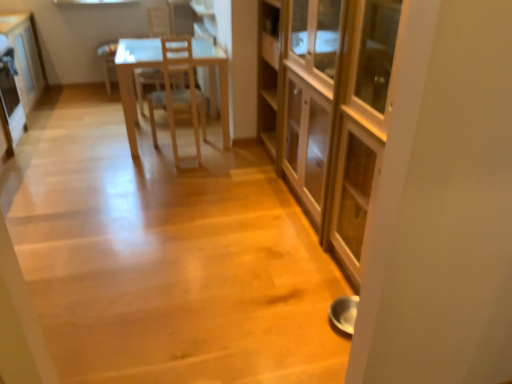
This screenshot has height=384, width=512. What do you see at coordinates (178, 94) in the screenshot?
I see `wooden chair at center` at bounding box center [178, 94].

The width and height of the screenshot is (512, 384). What do you see at coordinates (10, 98) in the screenshot?
I see `metallic refrigerator at left` at bounding box center [10, 98].

In order to click on metallic refrigerator at left in this screenshot , I will do `click(10, 98)`.

Measure the distance between white glossy cabinet at upper left, the 2th cabinetry from the front, and camera.

A distance of 3.25 meters exists between white glossy cabinet at upper left, the 2th cabinetry from the front, and camera.

Identify the location of matte wooden cabinet at center, which appears as the second cabinetry when viewed from the back. (328, 109).

Locate an element on the screen. This screenshot has height=384, width=512. appliance above the matte wooden cabinet at center, which is the first cabinetry from right to left (from the image's perspective) is located at coordinates (10, 98).

Considering the relative positions of metallic refrigerator at left and matte wooden cabinet at center, which is the first cabinetry from right to left, in the image provided, is metallic refrigerator at left to the right of matte wooden cabinet at center, which is the first cabinetry from right to left, from the viewer's perspective?

Incorrect, metallic refrigerator at left is not on the right side of matte wooden cabinet at center, which is the first cabinetry from right to left.

How many degrees apart are the facing directions of metallic refrigerator at left and matte wooden cabinet at center, which appears as the second cabinetry when viewed from the back?

There is a 179-degree angle between the facing directions of metallic refrigerator at left and matte wooden cabinet at center, which appears as the second cabinetry when viewed from the back.

Measure the distance between metallic refrigerator at left and matte wooden cabinet at center, the second cabinetry positioned from the left.

metallic refrigerator at left is 2.33 meters away from matte wooden cabinet at center, the second cabinetry positioned from the left.

From their relative heights in the image, would you say matte wooden cabinet at center, marked as the 1th cabinetry in a front-to-back arrangement, is taller or shorter than metallic refrigerator at left?

In the image, matte wooden cabinet at center, marked as the 1th cabinetry in a front-to-back arrangement, appears to be taller than metallic refrigerator at left.

Between matte wooden cabinet at center, the second cabinetry positioned from the left, and metallic refrigerator at left, which one has smaller size?

metallic refrigerator at left is smaller.

Is matte wooden cabinet at center, marked as the 1th cabinetry in a front-to-back arrangement, positioned in front of metallic refrigerator at left?

Yes, matte wooden cabinet at center, marked as the 1th cabinetry in a front-to-back arrangement, is in front of metallic refrigerator at left.

Would you consider matte wooden cabinet at center, marked as the 1th cabinetry in a front-to-back arrangement, to be distant from metallic refrigerator at left?

That's right, there is a large distance between matte wooden cabinet at center, marked as the 1th cabinetry in a front-to-back arrangement, and metallic refrigerator at left.

From the image's perspective, which object appears higher, light brown wooden chair at center or wooden chair at center?

light brown wooden chair at center.

From a real-world perspective, which is physically below, light brown wooden chair at center or wooden chair at center?

light brown wooden chair at center, from a real-world perspective.

Is light brown wooden chair at center located outside wooden chair at center?

Yes.

Would you consider wooden chair at center to be distant from matte wooden cabinet at center, marked as the 1th cabinetry in a front-to-back arrangement?

No, wooden chair at center is not far away from matte wooden cabinet at center, marked as the 1th cabinetry in a front-to-back arrangement.

Can we say wooden chair at center lies outside matte wooden cabinet at center, which appears as the second cabinetry when viewed from the back?

Absolutely, wooden chair at center is external to matte wooden cabinet at center, which appears as the second cabinetry when viewed from the back.

Can you confirm if wooden chair at center is bigger than matte wooden cabinet at center, marked as the 1th cabinetry in a front-to-back arrangement?

No, wooden chair at center is not bigger than matte wooden cabinet at center, marked as the 1th cabinetry in a front-to-back arrangement.

From a real-world perspective, which is physically above, wooden chair at center or matte wooden cabinet at center, marked as the 1th cabinetry in a front-to-back arrangement?

In real-world perspective, matte wooden cabinet at center, marked as the 1th cabinetry in a front-to-back arrangement, is above.

From a real-world perspective, which is physically below, white glossy cabinet at upper left, the second cabinetry when ordered from right to left, or metallic refrigerator at left?

From a 3D spatial view, metallic refrigerator at left is below.

Where is `appliance that appears on the right of white glossy cabinet at upper left, the first cabinetry when ordered from left to right`? This screenshot has height=384, width=512. appliance that appears on the right of white glossy cabinet at upper left, the first cabinetry when ordered from left to right is located at coordinates (10, 98).

Can you see white glossy cabinet at upper left, the second cabinetry when ordered from right to left, touching metallic refrigerator at left?

No, white glossy cabinet at upper left, the second cabinetry when ordered from right to left, is not in contact with metallic refrigerator at left.

Considering the positions of point (31, 13) and point (9, 88), is point (31, 13) closer or farther from the camera than point (9, 88)?

Point (31, 13) appears to be farther away from the viewer than point (9, 88).

Between wooden chair at center and light brown wooden chair at center, which one has larger width?

With larger width is wooden chair at center.

Does wooden chair at center touch light brown wooden chair at center?

wooden chair at center is not next to light brown wooden chair at center, and they're not touching.

From the image's perspective, is wooden chair at center over light brown wooden chair at center?

Actually, wooden chair at center appears below light brown wooden chair at center in the image.

Locate an element on the screen. The image size is (512, 384). armchair directly beneath the wooden chair at center (from a real-world perspective) is located at coordinates (146, 83).

Considering the sizes of matte wooden cabinet at center, the second cabinetry positioned from the left, and light brown wooden chair at center in the image, is matte wooden cabinet at center, the second cabinetry positioned from the left, taller or shorter than light brown wooden chair at center?

matte wooden cabinet at center, the second cabinetry positioned from the left, is taller than light brown wooden chair at center.

Is point (366, 5) positioned in front of point (139, 109)?

Yes, point (366, 5) is in front of point (139, 109).

From the image's perspective, who appears lower, matte wooden cabinet at center, which is the first cabinetry from right to left, or light brown wooden chair at center?

matte wooden cabinet at center, which is the first cabinetry from right to left, is shown below in the image.

The height and width of the screenshot is (384, 512). In order to click on cabinetry lying in front of the metallic refrigerator at left in this screenshot , I will do `click(328, 109)`.

In order to click on appliance behind the matte wooden cabinet at center, which appears as the second cabinetry when viewed from the back in this screenshot , I will do `click(10, 98)`.

Looking at this image, considering their positions, is white glossy cabinet at upper left, which is the first cabinetry from back to front, positioned closer to matte wooden cabinet at center, which is the first cabinetry from right to left, than wooden chair at center?

wooden chair at center.

Which object lies nearer to the anchor point metallic refrigerator at left, light brown wooden chair at center or matte wooden cabinet at center, marked as the 1th cabinetry in a front-to-back arrangement?

The object closer to metallic refrigerator at left is light brown wooden chair at center.

Based on their spatial positions, is matte wooden cabinet at center, which appears as the second cabinetry when viewed from the back, or wooden chair at center closer to metallic refrigerator at left?

wooden chair at center is closer to metallic refrigerator at left.

From the image, which object appears to be farther from light brown wooden chair at center, wooden chair at center or metallic refrigerator at left?

metallic refrigerator at left.

Which object lies further to the anchor point white glossy cabinet at upper left, the second cabinetry when ordered from right to left, matte wooden cabinet at center, which is the first cabinetry from right to left, or metallic refrigerator at left?

matte wooden cabinet at center, which is the first cabinetry from right to left, is positioned further to the anchor white glossy cabinet at upper left, the second cabinetry when ordered from right to left.

Looking at the image, which one is located further to wooden chair at center, white glossy cabinet at upper left, the first cabinetry when ordered from left to right, or light brown wooden chair at center?

white glossy cabinet at upper left, the first cabinetry when ordered from left to right, lies further to wooden chair at center than the other object.

Based on the photo, estimate the real-world distances between objects in this image. Which object is closer to wooden chair at center, light brown wooden chair at center or matte wooden cabinet at center, which appears as the second cabinetry when viewed from the back?

The object closer to wooden chair at center is light brown wooden chair at center.

Based on their spatial positions, is metallic refrigerator at left or white glossy cabinet at upper left, the first cabinetry when ordered from left to right, further from wooden chair at center?

The object further to wooden chair at center is white glossy cabinet at upper left, the first cabinetry when ordered from left to right.

This screenshot has width=512, height=384. Identify the location of appliance between white glossy cabinet at upper left, the second cabinetry when ordered from right to left, and wooden chair at center, in the horizontal direction. pos(10,98).

What are the coordinates of `appliance between white glossy cabinet at upper left, the 2th cabinetry from the front, and light brown wooden chair at center` in the screenshot? It's located at (10, 98).

Locate an element on the screen. Image resolution: width=512 pixels, height=384 pixels. appliance between white glossy cabinet at upper left, the first cabinetry when ordered from left to right, and matte wooden cabinet at center, which is the first cabinetry from right to left, from left to right is located at coordinates (10, 98).

Where is `armchair between metallic refrigerator at left and wooden chair at center from left to right`? armchair between metallic refrigerator at left and wooden chair at center from left to right is located at coordinates (146, 83).